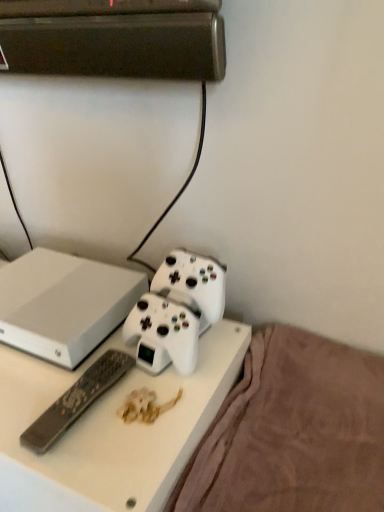
Where is `free point in front of white matte gaming console at center`? free point in front of white matte gaming console at center is located at coordinates point(65,394).